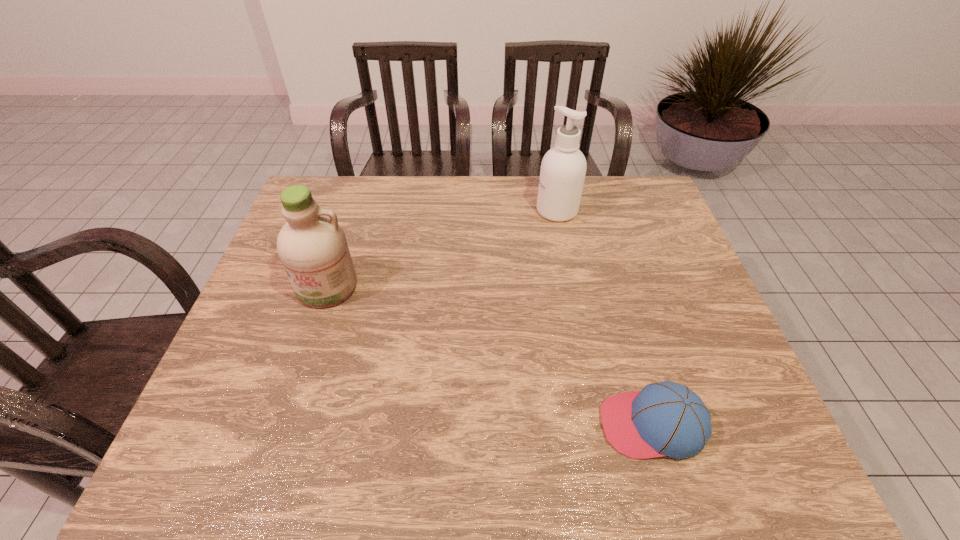
Locate an element on the screen. This screenshot has height=540, width=960. the farthest object is located at coordinates (563, 168).

This screenshot has height=540, width=960. I want to click on the right cleansing agent, so click(563, 168).

Identify the location of the second nearest object. (312, 246).

The height and width of the screenshot is (540, 960). I want to click on the left cleansing agent, so click(x=312, y=246).

This screenshot has height=540, width=960. I want to click on the shortest object, so click(668, 419).

Image resolution: width=960 pixels, height=540 pixels. Find the location of `the nearest object`. the nearest object is located at coordinates (668, 419).

Where is `free space located on the front label of the farther cleansing agent`? The image size is (960, 540). free space located on the front label of the farther cleansing agent is located at coordinates (495, 211).

Where is `vacant area situated 0.280m on the front label of the farther cleansing agent`? The width and height of the screenshot is (960, 540). vacant area situated 0.280m on the front label of the farther cleansing agent is located at coordinates (448, 211).

Locate an element on the screen. vacant region located 0.400m on the front label of the farther cleansing agent is located at coordinates (411, 211).

You are a GUI agent. You are given a task and a screenshot of the screen. Output one action in this format:
    pyautogui.click(x=<x>, y=<y>)
    Task: Click on the free space located on the front label of the nearer cleansing agent
    The width and height of the screenshot is (960, 540).
    Given the screenshot: What is the action you would take?
    pyautogui.click(x=301, y=364)